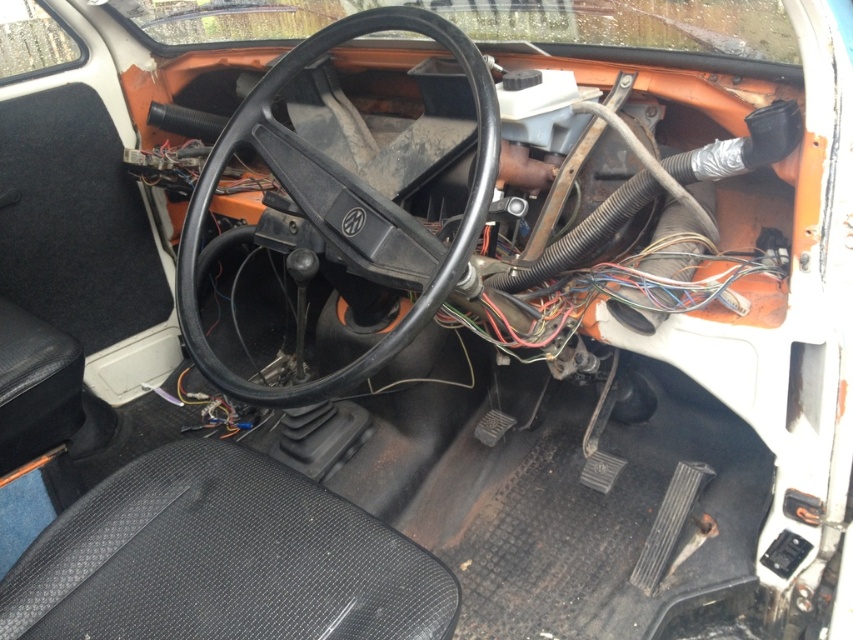
Question: Which point appears farthest from the camera in this image?

Choices:
 (A) (357, 266)
 (B) (206, 486)

Answer: (B)

Question: Can you confirm if black textured seat at lower left is bigger than black matte steering wheel at center?

Choices:
 (A) no
 (B) yes

Answer: (A)

Question: Can you confirm if black textured seat at lower left is positioned to the right of black matte steering wheel at center?

Choices:
 (A) yes
 (B) no

Answer: (B)

Question: Among these points, which one is nearest to the camera?

Choices:
 (A) (380, 230)
 (B) (376, 630)

Answer: (B)

Question: Does black textured seat at lower left have a lesser width compared to black matte steering wheel at center?

Choices:
 (A) no
 (B) yes

Answer: (A)